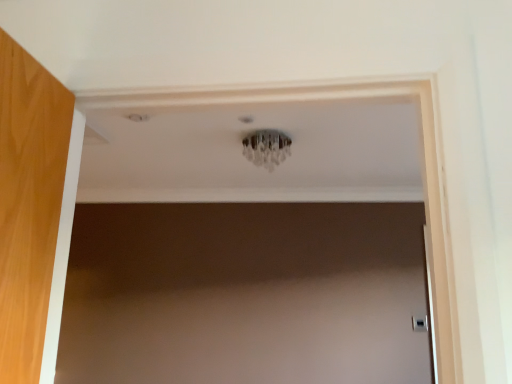
Question: Is clear crystal chandelier at center inside satin silver door handle at lower right?

Choices:
 (A) yes
 (B) no

Answer: (B)

Question: Is satin silver door handle at lower right oriented towards clear crystal chandelier at center?

Choices:
 (A) no
 (B) yes

Answer: (A)

Question: Is satin silver door handle at lower right positioned in front of clear crystal chandelier at center?

Choices:
 (A) no
 (B) yes

Answer: (A)

Question: From the image's perspective, does satin silver door handle at lower right appear higher than clear crystal chandelier at center?

Choices:
 (A) yes
 (B) no

Answer: (B)

Question: Can you confirm if satin silver door handle at lower right is thinner than clear crystal chandelier at center?

Choices:
 (A) yes
 (B) no

Answer: (A)

Question: Can you confirm if satin silver door handle at lower right is positioned to the right of clear crystal chandelier at center?

Choices:
 (A) yes
 (B) no

Answer: (A)

Question: Can you confirm if clear crystal chandelier at center is taller than satin silver door handle at lower right?

Choices:
 (A) no
 (B) yes

Answer: (B)

Question: Is clear crystal chandelier at center behind satin silver door handle at lower right?

Choices:
 (A) yes
 (B) no

Answer: (B)

Question: Is satin silver door handle at lower right located within clear crystal chandelier at center?

Choices:
 (A) yes
 (B) no

Answer: (B)

Question: From a real-world perspective, is clear crystal chandelier at center physically above satin silver door handle at lower right?

Choices:
 (A) no
 (B) yes

Answer: (B)

Question: Is clear crystal chandelier at center to the right of satin silver door handle at lower right from the viewer's perspective?

Choices:
 (A) yes
 (B) no

Answer: (B)

Question: Is clear crystal chandelier at center directly adjacent to satin silver door handle at lower right?

Choices:
 (A) yes
 (B) no

Answer: (B)

Question: From the image's perspective, is satin silver door handle at lower right above or below clear crystal chandelier at center?

Choices:
 (A) above
 (B) below

Answer: (B)